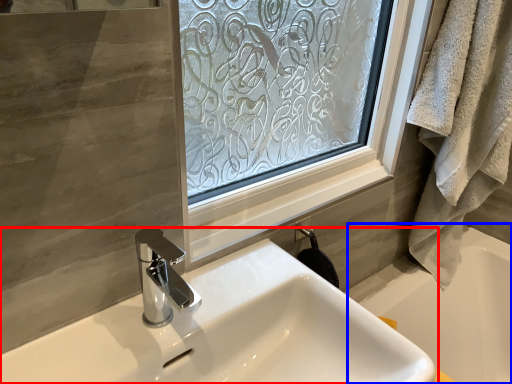
Question: Which point is further to the camera, sink (highlighted by a red box) or bath (highlighted by a blue box)?

Choices:
 (A) sink
 (B) bath

Answer: (B)